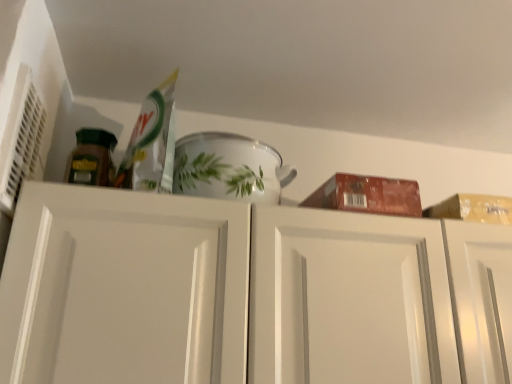
Question: From the image's perspective, is white matte cabinet doors at upper center above or below white glossy bowl at upper center?

Choices:
 (A) above
 (B) below

Answer: (B)

Question: In terms of width, does white matte cabinet doors at upper center look wider or thinner when compared to white glossy bowl at upper center?

Choices:
 (A) thin
 (B) wide

Answer: (B)

Question: Considering the positions of white matte cabinet doors at upper center and white glossy bowl at upper center in the image, is white matte cabinet doors at upper center bigger or smaller than white glossy bowl at upper center?

Choices:
 (A) small
 (B) big

Answer: (B)

Question: Considering their positions, is white glossy bowl at upper center located in front of or behind white matte cabinet doors at upper center?

Choices:
 (A) behind
 (B) front

Answer: (A)

Question: Is white glossy bowl at upper center bigger or smaller than white matte cabinet doors at upper center?

Choices:
 (A) small
 (B) big

Answer: (A)

Question: From a real-world perspective, is white glossy bowl at upper center above or below white matte cabinet doors at upper center?

Choices:
 (A) above
 (B) below

Answer: (A)

Question: Is white glossy bowl at upper center wider or thinner than white matte cabinet doors at upper center?

Choices:
 (A) thin
 (B) wide

Answer: (A)